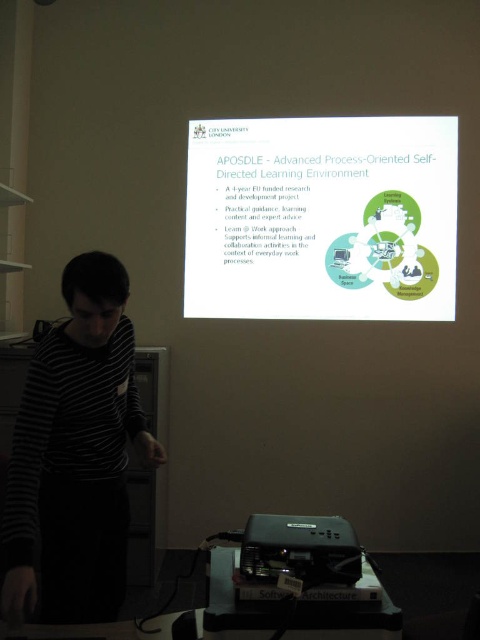
You are an attendee at the presentation and want to take a photo of the presenter and the projector screen. The presenter is wearing a black striped shirt at left and there is a black plastic projector at lower center. Which object should you focus on first if you want to capture both in the frame?

The black striped shirt at left is positioned on the left side of black plastic projector at lower center, so you should focus on the black striped shirt at left first to ensure both are in the frame.

You are an attendee at the presentation and want to take a photo of the presenter and the projector screen. The camera you have can only focus on objects at the same height. Is the black striped shirt at left and the black plastic projector at lower center at the same height?

The black striped shirt at left is located above the black plastic projector at lower center, so they are not at the same height. The camera cannot focus on both at the same time.